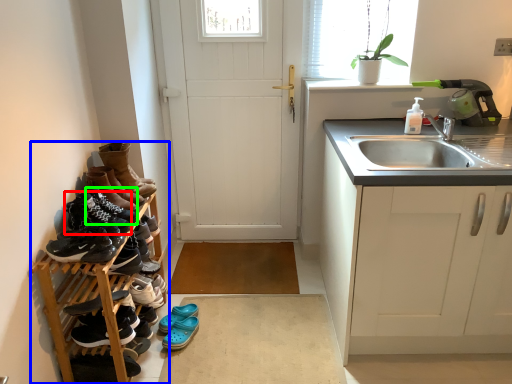
Question: Which is farther away from footwear (highlighted by a red box)? carpetry (highlighted by a blue box) or shoe (highlighted by a green box)?

Choices:
 (A) carpetry
 (B) shoe

Answer: (A)